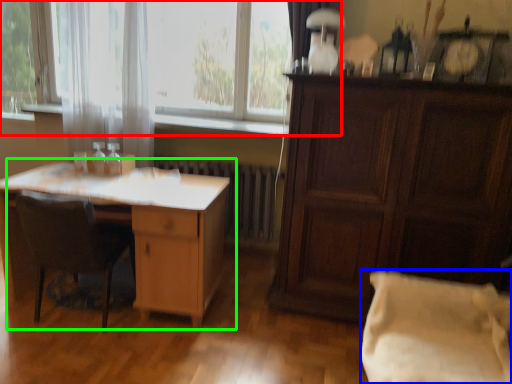
Question: Which object is the farthest from window (highlighted by a red box)? Choose among these: pillow (highlighted by a blue box) or desk (highlighted by a green box).

Choices:
 (A) pillow
 (B) desk

Answer: (A)